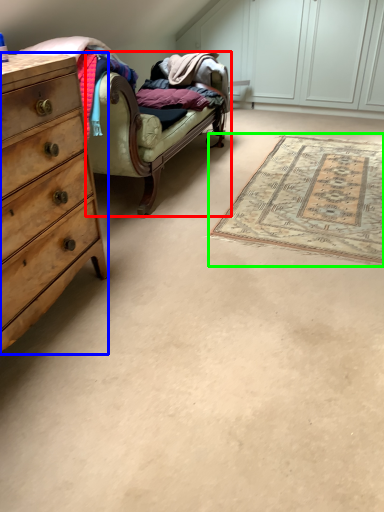
Question: Based on their relative distances, which object is farther from studio couch (highlighted by a red box)? Choose from chest of drawers (highlighted by a blue box) and mat (highlighted by a green box).

Choices:
 (A) chest of drawers
 (B) mat

Answer: (A)